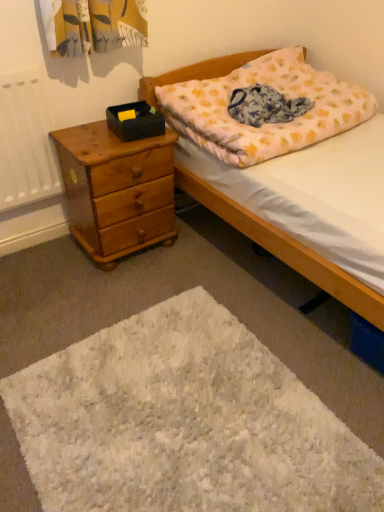
What do you see at coordinates (265, 106) in the screenshot?
I see `floral cotton blanket at center` at bounding box center [265, 106].

Where is `white fluffy mat at lower center`? white fluffy mat at lower center is located at coordinates (183, 422).

Find the location of `light brown wooden chest of drawers at left`. light brown wooden chest of drawers at left is located at coordinates (116, 190).

This screenshot has width=384, height=512. I want to click on pillow in front of the light brown wooden chest of drawers at left, so click(265, 120).

Considering the relative sizes of light brown wooden chest of drawers at left and fluffy cotton pillow at upper right in the image provided, is light brown wooden chest of drawers at left wider than fluffy cotton pillow at upper right?

Incorrect, the width of light brown wooden chest of drawers at left does not surpass that of fluffy cotton pillow at upper right.

Can you tell me how much light brown wooden chest of drawers at left and fluffy cotton pillow at upper right differ in facing direction?

There is a 3.1-degree angle between the facing directions of light brown wooden chest of drawers at left and fluffy cotton pillow at upper right.

Is light brown wooden chest of drawers at left next to fluffy cotton pillow at upper right and touching it?

No.

How different are the orientations of fluffy cotton pillow at upper right and light brown wooden chest of drawers at left in degrees?

The facing directions of fluffy cotton pillow at upper right and light brown wooden chest of drawers at left are 3.1 degrees apart.

From the image's perspective, is fluffy cotton pillow at upper right above light brown wooden chest of drawers at left?

Yes, from the image's perspective, fluffy cotton pillow at upper right is on top of light brown wooden chest of drawers at left.

Could you tell me if fluffy cotton pillow at upper right is facing light brown wooden chest of drawers at left?

No, fluffy cotton pillow at upper right is not turned towards light brown wooden chest of drawers at left.

Between fluffy cotton pillow at upper right and light brown wooden chest of drawers at left, which one has smaller size?

light brown wooden chest of drawers at left is smaller.

Is white fluffy mat at lower center not near light brown wooden chest of drawers at left?

No, there isn't a large distance between white fluffy mat at lower center and light brown wooden chest of drawers at left.

Can you confirm if white fluffy mat at lower center is taller than light brown wooden chest of drawers at left?

No, white fluffy mat at lower center is not taller than light brown wooden chest of drawers at left.

Is white fluffy mat at lower center facing away from light brown wooden chest of drawers at left?

No, white fluffy mat at lower center is not facing away from light brown wooden chest of drawers at left.

Where is `mat located on the right of light brown wooden chest of drawers at left`? This screenshot has height=512, width=384. mat located on the right of light brown wooden chest of drawers at left is located at coordinates (183, 422).

Considering the positions of objects fluffy cotton pillow at upper right and floral cotton blanket at center in the image provided, who is more to the right, fluffy cotton pillow at upper right or floral cotton blanket at center?

fluffy cotton pillow at upper right is more to the right.

Does fluffy cotton pillow at upper right have a lesser width compared to floral cotton blanket at center?

No, fluffy cotton pillow at upper right is not thinner than floral cotton blanket at center.

Can you see fluffy cotton pillow at upper right touching floral cotton blanket at center?

No, fluffy cotton pillow at upper right is not making contact with floral cotton blanket at center.

This screenshot has height=512, width=384. What are the coordinates of `pillow lying above the floral cotton blanket at center (from the image's perspective)` in the screenshot? It's located at (265, 120).

In the scene shown: How far apart are floral cotton blanket at center and fluffy cotton pillow at upper right?

A distance of 4.45 inches exists between floral cotton blanket at center and fluffy cotton pillow at upper right.

Considering the sizes of floral cotton blanket at center and fluffy cotton pillow at upper right in the image, is floral cotton blanket at center wider or thinner than fluffy cotton pillow at upper right?

Clearly, floral cotton blanket at center has less width compared to fluffy cotton pillow at upper right.

From the image's perspective, relative to fluffy cotton pillow at upper right, is floral cotton blanket at center above or below?

Based on their image positions, floral cotton blanket at center is located beneath fluffy cotton pillow at upper right.

Is floral cotton blanket at center positioned behind fluffy cotton pillow at upper right?

Yes, it is.

From the image's perspective, would you say white fluffy mat at lower center is positioned over fluffy cotton pillow at upper right?

No, from the image's perspective, white fluffy mat at lower center is not above fluffy cotton pillow at upper right.

Considering the positions of objects white fluffy mat at lower center and fluffy cotton pillow at upper right in the image provided, who is more to the right, white fluffy mat at lower center or fluffy cotton pillow at upper right?

Positioned to the right is fluffy cotton pillow at upper right.

Is white fluffy mat at lower center taller than fluffy cotton pillow at upper right?

No.

Is white fluffy mat at lower center inside the boundaries of fluffy cotton pillow at upper right, or outside?

The correct answer is: outside.

Is floral cotton blanket at center to the left of light brown wooden chest of drawers at left from the viewer's perspective?

No, floral cotton blanket at center is not to the left of light brown wooden chest of drawers at left.

Between point (233, 112) and point (100, 179), which one is positioned behind?

The point (233, 112) is behind.

Looking at the image, does floral cotton blanket at center seem bigger or smaller compared to light brown wooden chest of drawers at left?

floral cotton blanket at center is smaller than light brown wooden chest of drawers at left.

Is floral cotton blanket at center taller or shorter than light brown wooden chest of drawers at left?

Clearly, floral cotton blanket at center is shorter compared to light brown wooden chest of drawers at left.

The width and height of the screenshot is (384, 512). In order to click on chest of drawers to the left of fluffy cotton pillow at upper right in this screenshot , I will do `click(116, 190)`.

Where is `pillow lying above the light brown wooden chest of drawers at left (from the image's perspective)`? The image size is (384, 512). pillow lying above the light brown wooden chest of drawers at left (from the image's perspective) is located at coordinates coord(265,120).

Looking at the image, which one is located closer to fluffy cotton pillow at upper right, white fluffy mat at lower center or floral cotton blanket at center?

Among the two, floral cotton blanket at center is located nearer to fluffy cotton pillow at upper right.

Looking at the image, which one is located further to fluffy cotton pillow at upper right, floral cotton blanket at center or white fluffy mat at lower center?

Based on the image, white fluffy mat at lower center appears to be further to fluffy cotton pillow at upper right.

Looking at the image, which one is located further to floral cotton blanket at center, white fluffy mat at lower center or light brown wooden chest of drawers at left?

Based on the image, white fluffy mat at lower center appears to be further to floral cotton blanket at center.

Estimate the real-world distances between objects in this image. Which object is closer to fluffy cotton pillow at upper right, light brown wooden chest of drawers at left or white fluffy mat at lower center?

light brown wooden chest of drawers at left lies closer to fluffy cotton pillow at upper right than the other object.

Looking at the image, which one is located closer to floral cotton blanket at center, light brown wooden chest of drawers at left or white fluffy mat at lower center?

light brown wooden chest of drawers at left lies closer to floral cotton blanket at center than the other object.

Based on their spatial positions, is white fluffy mat at lower center or fluffy cotton pillow at upper right further from floral cotton blanket at center?

Among the two, white fluffy mat at lower center is located further to floral cotton blanket at center.

Based on their spatial positions, is floral cotton blanket at center or fluffy cotton pillow at upper right closer to white fluffy mat at lower center?

fluffy cotton pillow at upper right.

Considering their positions, is light brown wooden chest of drawers at left positioned closer to white fluffy mat at lower center than floral cotton blanket at center?

light brown wooden chest of drawers at left is positioned closer to the anchor white fluffy mat at lower center.

I want to click on the chest of drawers between fluffy cotton pillow at upper right and white fluffy mat at lower center vertically, so click(116, 190).

Identify the location of blanket situated between light brown wooden chest of drawers at left and fluffy cotton pillow at upper right from left to right. This screenshot has height=512, width=384. (265, 106).

Locate an element on the screen. The height and width of the screenshot is (512, 384). the chest of drawers that lies between floral cotton blanket at center and white fluffy mat at lower center from top to bottom is located at coordinates pyautogui.click(x=116, y=190).

Where is `blanket between fluffy cotton pillow at upper right and white fluffy mat at lower center from top to bottom`? blanket between fluffy cotton pillow at upper right and white fluffy mat at lower center from top to bottom is located at coordinates (265, 106).